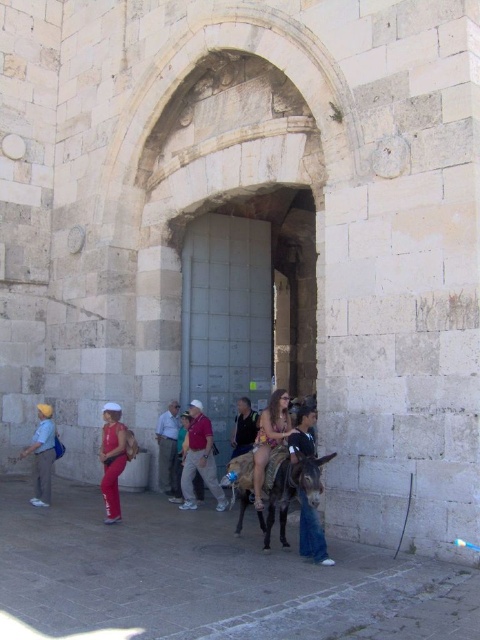
Question: Can you confirm if brown textured donkey at center is positioned below light blue denim jeans at lower left?

Choices:
 (A) no
 (B) yes

Answer: (A)

Question: Is blue jeans at center to the right of beige fabric bikini at center from the viewer's perspective?

Choices:
 (A) no
 (B) yes

Answer: (B)

Question: Which point is farther to the camera?

Choices:
 (A) (116, 448)
 (B) (260, 465)
 (C) (43, 451)

Answer: (C)

Question: Which object appears closest to the camera in this image?

Choices:
 (A) light brown leather jacket at center
 (B) brown textured donkey at center
 (C) beige fabric bikini at center

Answer: (B)

Question: Which object is closer to the camera taking this photo?

Choices:
 (A) blue jeans at center
 (B) matte pink pants at lower left
 (C) brown textured donkey at center
 (D) light brown leather pants at center

Answer: (C)

Question: Is brown textured donkey at center below light blue denim jeans at lower left?

Choices:
 (A) yes
 (B) no

Answer: (B)